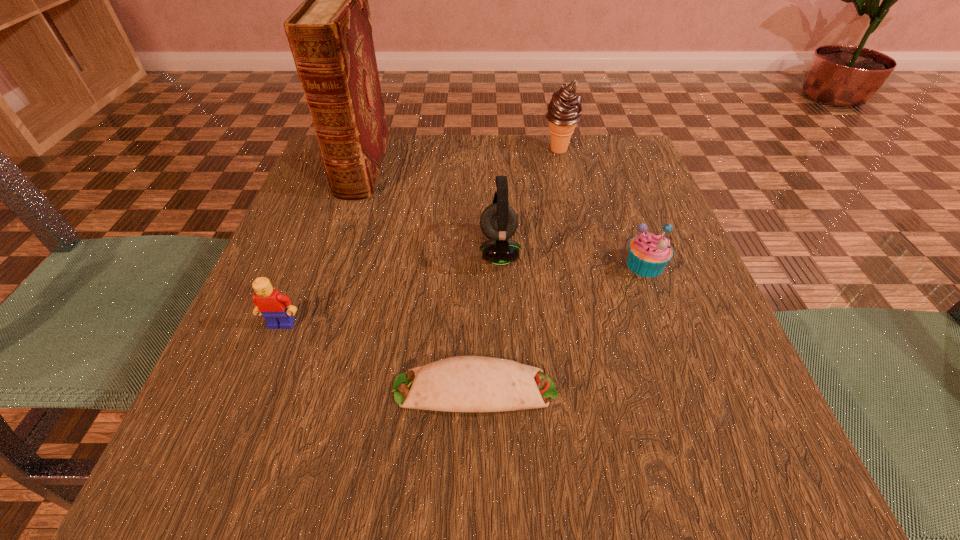
Identify the location of the tallest object. (330, 33).

Identify the location of icecream. This screenshot has height=540, width=960. (564, 110).

Locate an element on the screen. the third tallest object is located at coordinates (498, 222).

Locate an element on the screen. The image size is (960, 540). Lego is located at coordinates (271, 304).

Locate an element on the screen. The image size is (960, 540). the second nearest object is located at coordinates (271, 304).

At what (x,y) coordinates should I click in order to perform the action: click on muffin. Please return your answer as a coordinate pair (x, y). This screenshot has height=540, width=960. Looking at the image, I should click on (649, 253).

I want to click on the fifth tallest object, so click(x=649, y=253).

This screenshot has width=960, height=540. Find the location of `the shortest object`. the shortest object is located at coordinates (464, 383).

You are a GUI agent. You are given a task and a screenshot of the screen. Output one action in this format:
    pyautogui.click(x=<x>, y=<y>)
    Task: Click on the nearest object
    The image size is (960, 540).
    Given the screenshot: What is the action you would take?
    pyautogui.click(x=464, y=383)

Identify the location of vacant position located 0.260m on the spine side of the hardback book. The image size is (960, 540). (318, 296).